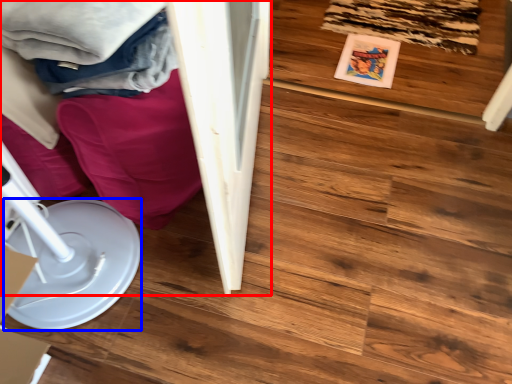
Question: Among these objects, which one is nearest to the camera, furniture (highlighted by a red box) or paper plate (highlighted by a blue box)?

Choices:
 (A) furniture
 (B) paper plate

Answer: (B)